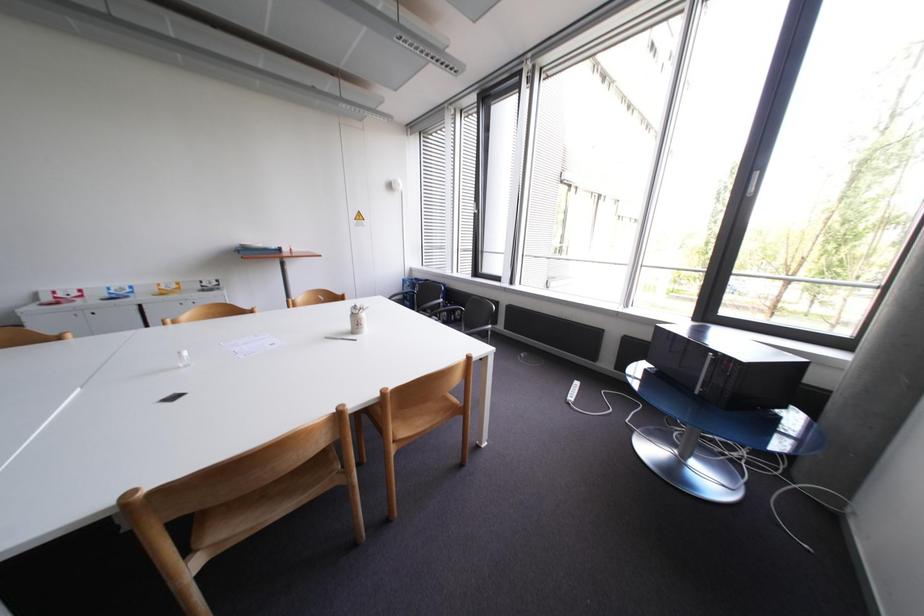
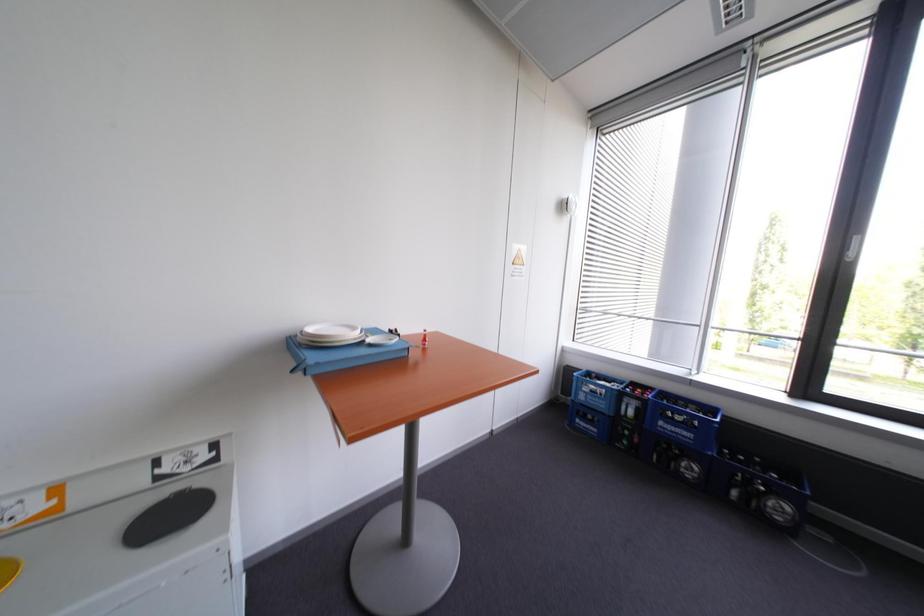
The images are taken continuously from a first-person perspective. In which direction are you moving?

The cameraman walked toward left, forward.